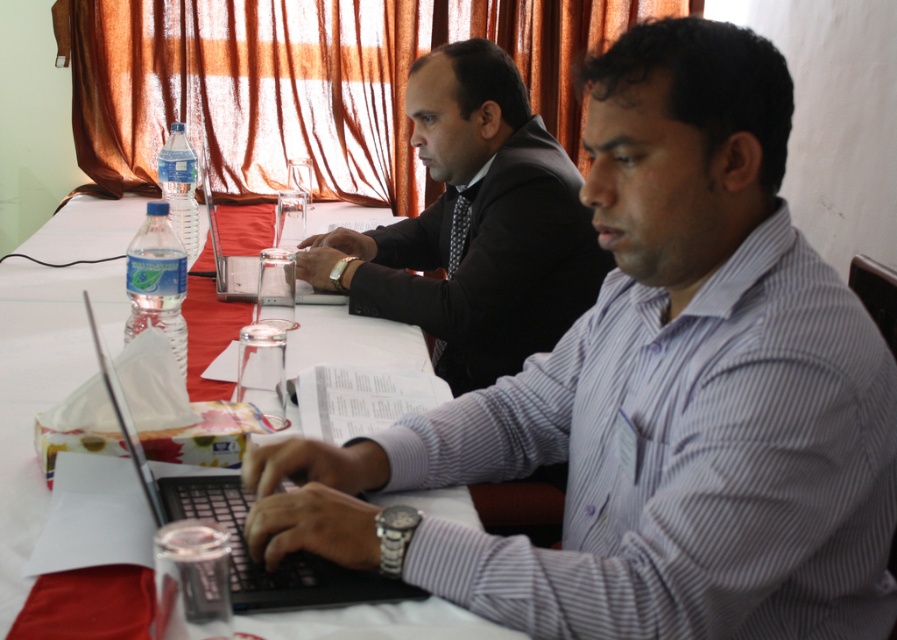
You are organizing a presentation and need to place both the matte black suit at center and the white paper at center on a narrow desk. Which object should you place first to ensure both fit side by side?

The matte black suit at center has a lesser width compared to the white paper at center, so you should place the white paper at center first to ensure both fit side by side.

Consider the image. You are organizing a meeting and need to place a new folder to the right of the clear plastic laptop at center. Where should you place the folder relative to the white paper at center?

The folder should be placed to the right of the clear plastic laptop at center, which would place it to the right of the white paper at center since the white paper at center is to the left of the clear plastic laptop at center.

You are organizing a meeting and need to ensure there is enough space between the matte black suit at center and the white paper at center for attendees to comfortably place their coffee cups. Based on the scene description, is there sufficient space?

The matte black suit at center is smaller than the white paper at center, so there is enough space between them to place coffee cups comfortably.